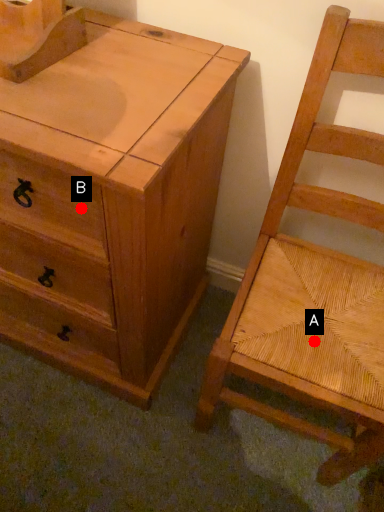
Question: Two points are circled on the image, labeled by A and B beside each circle. Which point is closer to the camera?

Choices:
 (A) A is closer
 (B) B is closer

Answer: (B)